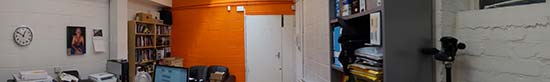
What are the coordinates of `clock` in the screenshot? It's located at (24, 35).